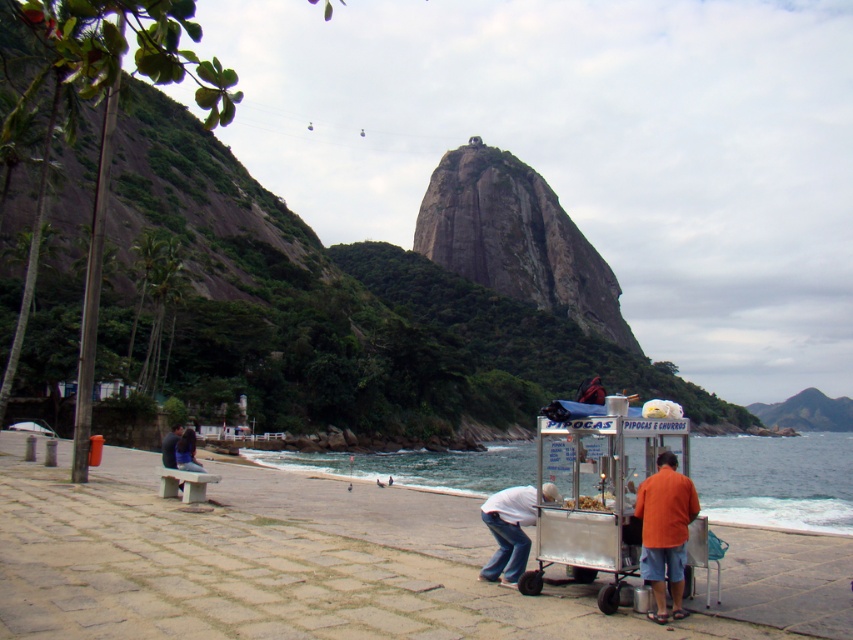
Question: Is smooth sand beach at lower center positioned behind white cotton shirt at lower center?

Choices:
 (A) no
 (B) yes

Answer: (A)

Question: Among these points, which one is nearest to the camera?

Choices:
 (A) (654, 506)
 (B) (53, 492)

Answer: (A)

Question: Which object appears farthest from the camera in this image?

Choices:
 (A) smooth sand beach at lower center
 (B) white cotton shirt at lower center

Answer: (B)

Question: Is metallic silver cart at lower center to the right of white cotton shirt at lower center from the viewer's perspective?

Choices:
 (A) no
 (B) yes

Answer: (B)

Question: Which object is positioned farthest from the clear blue water at lower center?

Choices:
 (A) metallic silver cart at lower center
 (B) smooth sand beach at lower center
 (C) orange cotton shirt at lower right
 (D) white cotton shirt at lower center

Answer: (D)

Question: Is metallic silver cart at lower center to the left of clear blue water at lower center from the viewer's perspective?

Choices:
 (A) yes
 (B) no

Answer: (A)